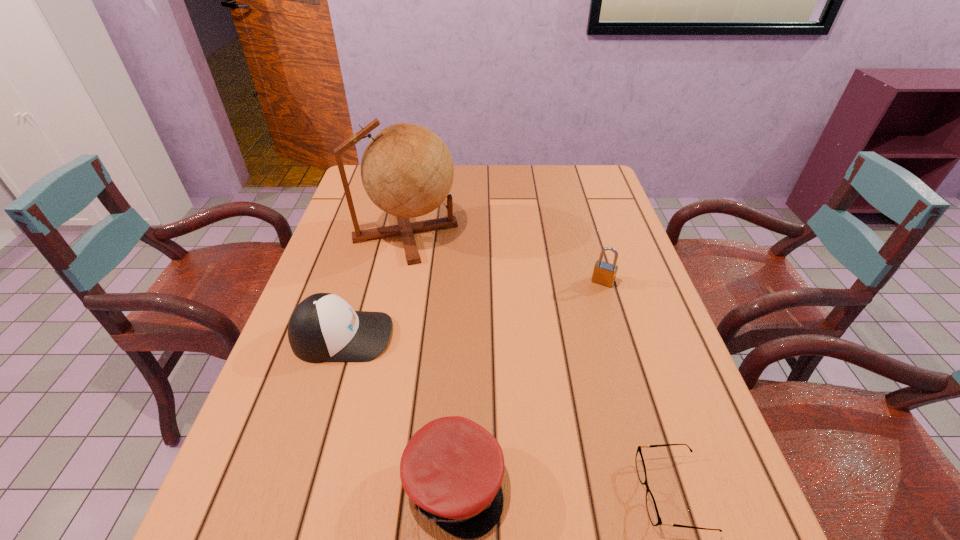
Find the location of a particular element. empty location between the third farthest object and the nearer cap is located at coordinates (398, 410).

Find the location of a particular element. vacant region between the right cap and the farther cap is located at coordinates (398, 410).

Identify the location of vacant point located between the farther cap and the spectacles. (508, 414).

This screenshot has height=540, width=960. Find the location of `blank region between the padlock and the third nearest object`. blank region between the padlock and the third nearest object is located at coordinates (472, 309).

Where is `free space between the farthest object and the padlock`? The height and width of the screenshot is (540, 960). free space between the farthest object and the padlock is located at coordinates (504, 257).

Where is `object that stands as the second closest to the tallest object`? The image size is (960, 540). object that stands as the second closest to the tallest object is located at coordinates (604, 273).

Point out which object is positioned as the second nearest to the farthest object. Please provide its 2D coordinates. Your answer should be formatted as a tuple, i.e. [(x, y)], where the tuple contains the x and y coordinates of a point satisfying the conditions above.

[(604, 273)]

This screenshot has width=960, height=540. Identify the location of free space in the image that satisfies the following two spatial constraints: 1. on the surface of the padlock; 2. on the left side of the tallest object. (396, 282).